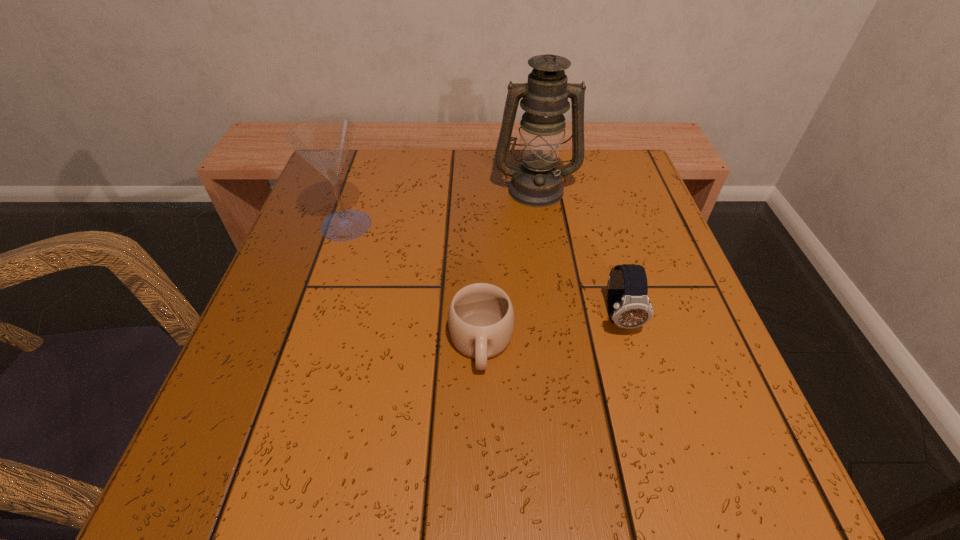
The image size is (960, 540). What are the coordinates of `free spot between the watch and the tallest object` in the screenshot? It's located at (578, 253).

Identify which object is the second closest to the watch. Please provide its 2D coordinates. Your answer should be formatted as a tuple, i.e. [(x, y)], where the tuple contains the x and y coordinates of a point satisfying the conditions above.

[(537, 182)]

Choose which object is the third nearest neighbor to the oil lamp. Please provide its 2D coordinates. Your answer should be formatted as a tuple, i.e. [(x, y)], where the tuple contains the x and y coordinates of a point satisfying the conditions above.

[(481, 317)]